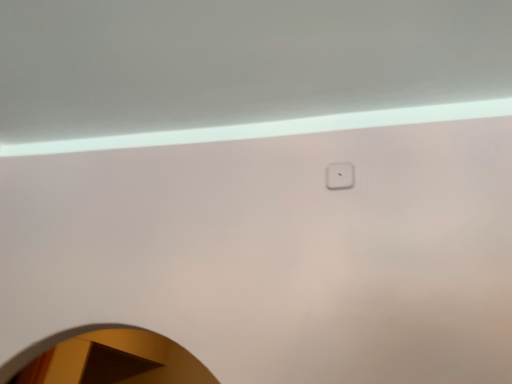
Question: Should I look upward or downward to see white glossy mirror at lower left?

Choices:
 (A) up
 (B) down

Answer: (B)

Question: Can white glossy mirror at lower left be found inside white plastic light switch at upper center?

Choices:
 (A) no
 (B) yes

Answer: (A)

Question: Can you confirm if white plastic light switch at upper center is shorter than white glossy mirror at lower left?

Choices:
 (A) no
 (B) yes

Answer: (B)

Question: Does white plastic light switch at upper center lie behind white glossy mirror at lower left?

Choices:
 (A) yes
 (B) no

Answer: (A)

Question: Considering the relative sizes of white plastic light switch at upper center and white glossy mirror at lower left in the image provided, is white plastic light switch at upper center wider than white glossy mirror at lower left?

Choices:
 (A) yes
 (B) no

Answer: (B)

Question: Does white plastic light switch at upper center have a smaller size compared to white glossy mirror at lower left?

Choices:
 (A) no
 (B) yes

Answer: (B)

Question: From a real-world perspective, is white plastic light switch at upper center located higher than white glossy mirror at lower left?

Choices:
 (A) yes
 (B) no

Answer: (A)

Question: Is white glossy mirror at lower left to the right of white plastic light switch at upper center from the viewer's perspective?

Choices:
 (A) no
 (B) yes

Answer: (A)

Question: Is white glossy mirror at lower left oriented away from white plastic light switch at upper center?

Choices:
 (A) yes
 (B) no

Answer: (B)

Question: From a real-world perspective, is white glossy mirror at lower left physically below white plastic light switch at upper center?

Choices:
 (A) yes
 (B) no

Answer: (A)

Question: Can you confirm if white glossy mirror at lower left is taller than white plastic light switch at upper center?

Choices:
 (A) no
 (B) yes

Answer: (B)

Question: From the image's perspective, does white glossy mirror at lower left appear lower than white plastic light switch at upper center?

Choices:
 (A) no
 (B) yes

Answer: (B)

Question: Does white glossy mirror at lower left lie in front of white plastic light switch at upper center?

Choices:
 (A) yes
 (B) no

Answer: (A)

Question: Based on their sizes in the image, would you say white glossy mirror at lower left is bigger or smaller than white plastic light switch at upper center?

Choices:
 (A) big
 (B) small

Answer: (A)